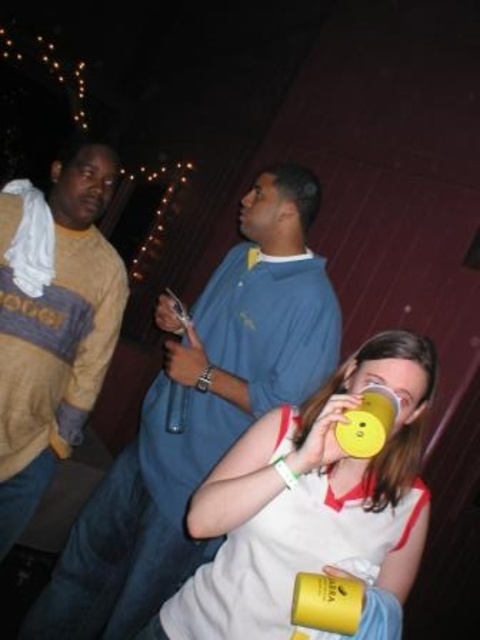
You are at a party and see the matte blue shirt at center and the yellow matte cup at center. Which one is positioned higher from the ground?

The matte blue shirt at center is located above the yellow matte cup at center, so it is higher from the ground.